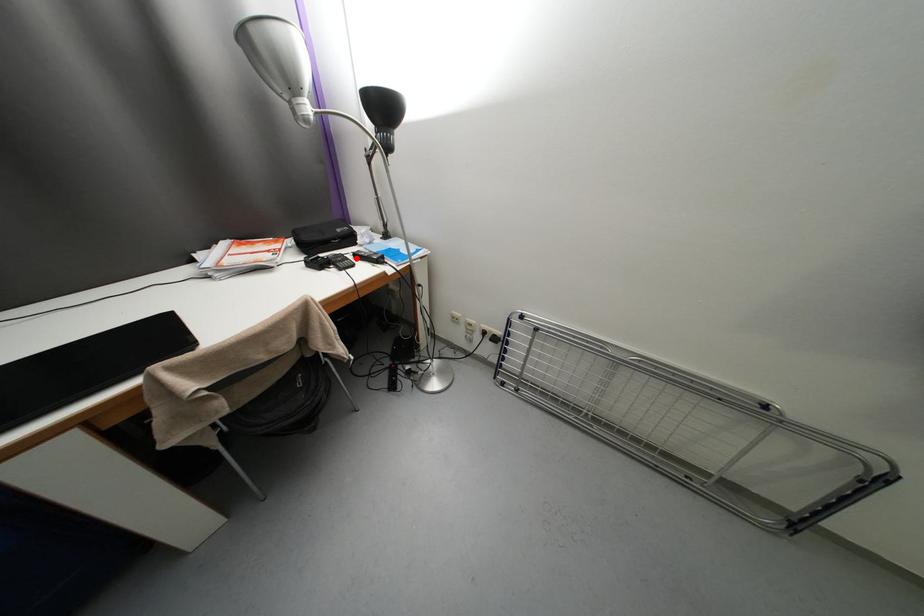
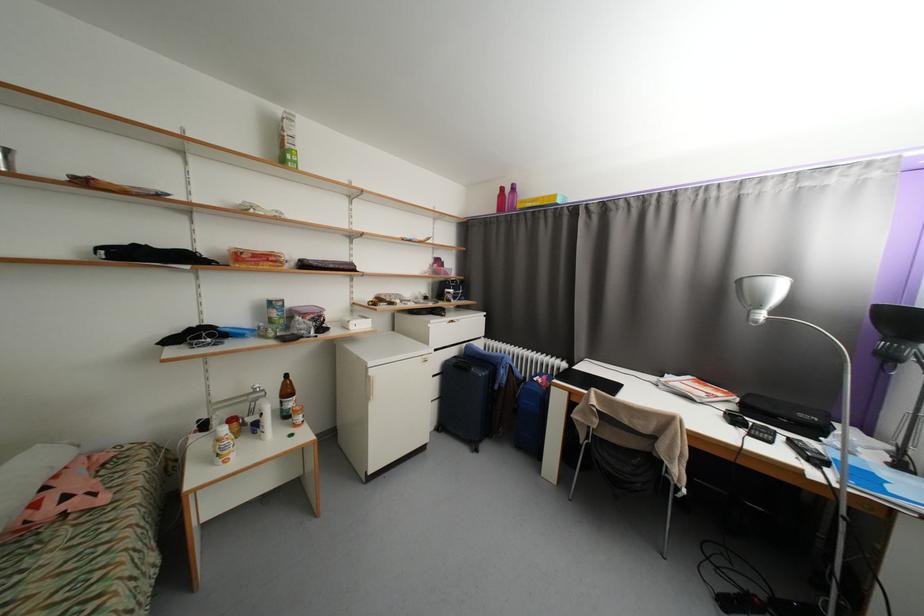
Locate, in the second image, the point that corresponds to the highlighted location in the first image.

(787, 439)